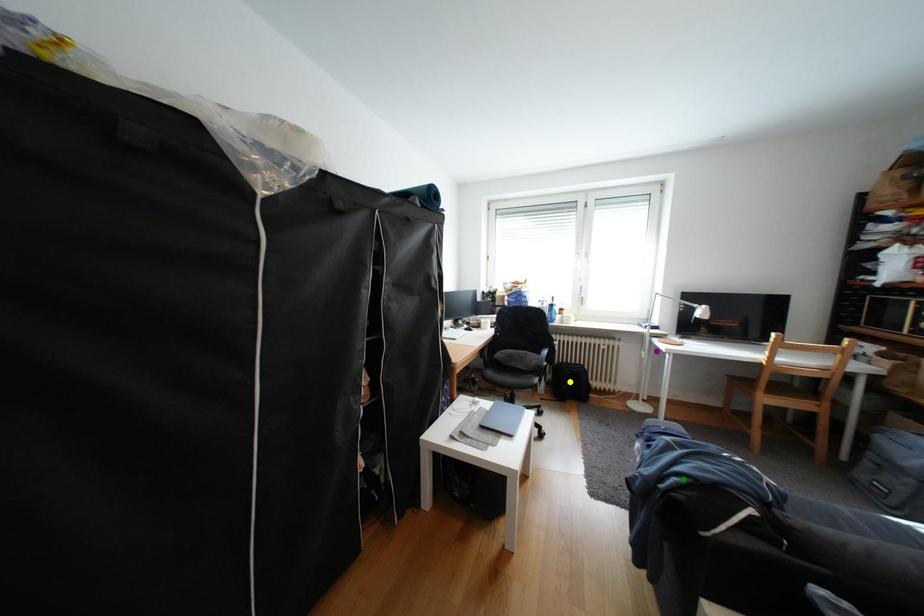
Order these from nearest to farthest:
1. purple point
2. green point
3. yellow point

1. green point
2. yellow point
3. purple point